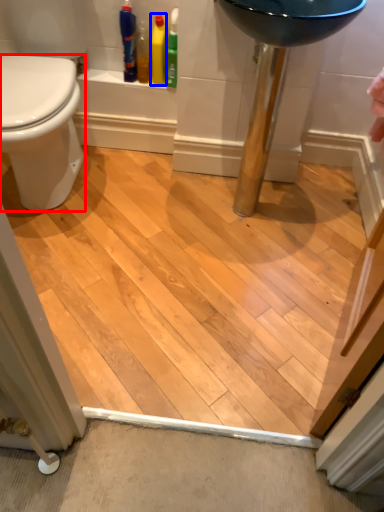
Question: Which of the following is the farthest to the observer, bidet (highlighted by a red box) or cleaning product (highlighted by a blue box)?

Choices:
 (A) bidet
 (B) cleaning product

Answer: (B)